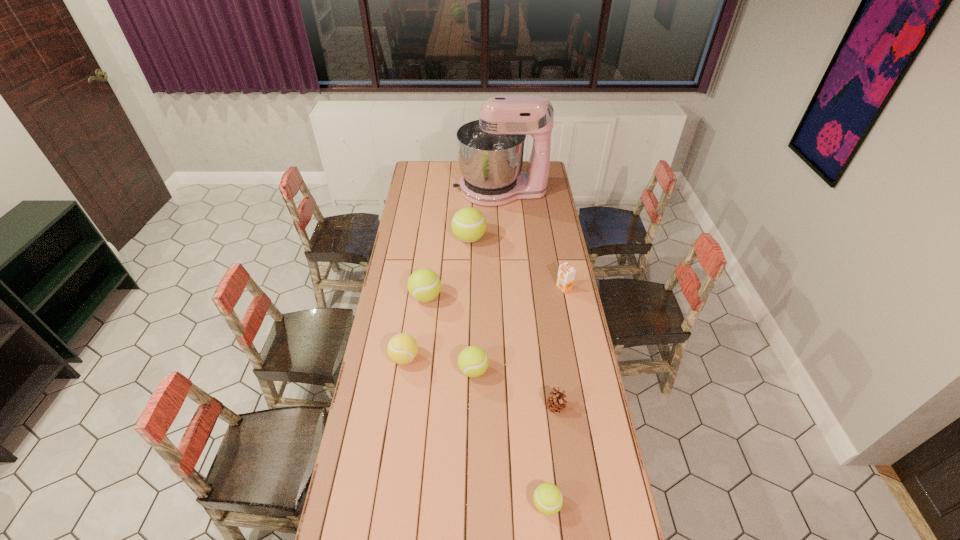
The width and height of the screenshot is (960, 540). What are the coordinates of `the nearest green tennis ball` in the screenshot? It's located at (548, 499).

The width and height of the screenshot is (960, 540). I want to click on the smallest green tennis ball, so click(548, 499).

At what (x,y) coordinates should I click in order to perform the action: click on blank space located 0.050m on the front-facing side of the mixer. Please return your answer as a coordinate pair (x, y). Looking at the image, I should click on (444, 190).

Identify the location of free point located on the front-facing side of the mixer. (431, 190).

Image resolution: width=960 pixels, height=540 pixels. In order to click on free location located on the front-facing side of the mixer in this screenshot , I will do `click(406, 190)`.

Where is `vacant area situated 0.140m on the right of the tallest tennis ball`? The image size is (960, 540). vacant area situated 0.140m on the right of the tallest tennis ball is located at coordinates tap(513, 239).

You are a GUI agent. You are given a task and a screenshot of the screen. Output one action in this format:
    pyautogui.click(x=<x>, y=<y>)
    Task: Click on the vacant region located on the front of the second tallest tennis ball
    Image resolution: width=960 pixels, height=540 pixels.
    Given the screenshot: What is the action you would take?
    pyautogui.click(x=417, y=374)

Locate an element on the screen. Image resolution: width=960 pixels, height=540 pixels. vacant position located 0.130m on the front of the orange orange juice is located at coordinates (569, 315).

You are a GUI agent. You are given a task and a screenshot of the screen. Output one action in this format:
    pyautogui.click(x=<x>, y=<y>)
    Task: Click on the free region located 0.260m on the front of the yellow tennis ball
    The image size is (960, 540).
    Given the screenshot: What is the action you would take?
    pyautogui.click(x=394, y=434)

Where is `vacant space positioned on the back of the second smallest green tennis ball`? Image resolution: width=960 pixels, height=540 pixels. vacant space positioned on the back of the second smallest green tennis ball is located at coordinates (474, 318).